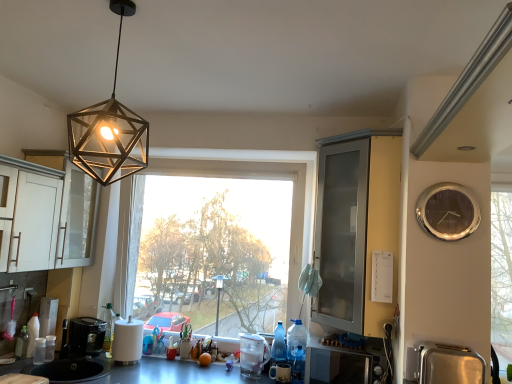
Locate an element on the screen. free area in between clear plastic blender at center, which is counted as the 3th appliance, starting from the right, and white matte paper towel holder at center, the 4th appliance from the right is located at coordinates (178, 369).